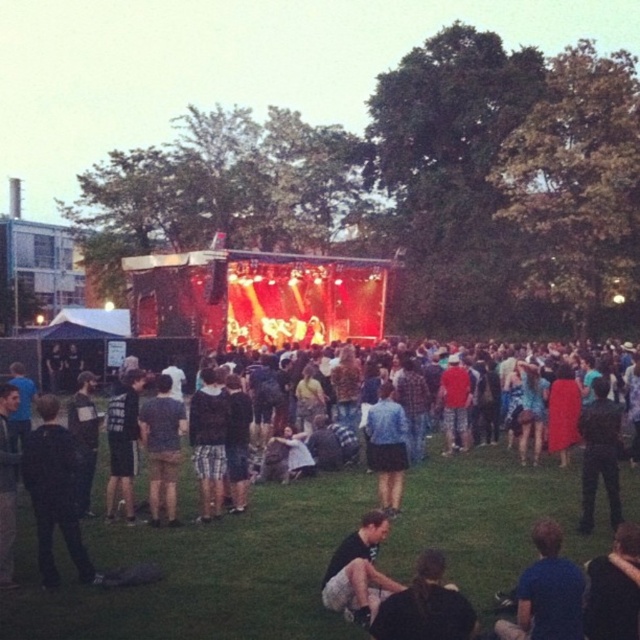
You are a photographer at the concert and want to capture a photo of the black matte jacket at left and dark gray fabric pants at lower center. Which object should you focus on first if you want to include both in the same frame without moving the camera?

The black matte jacket at left is above the dark gray fabric pants at lower center, so you should focus on the black matte jacket at left first to ensure both are in the frame.

You are standing at the center of the field and see a black matte jacket at left. Can you determine if the point marked at coordinates point (54,492) is located on the black matte jacket at left?

The point (54,492) is on the black matte jacket at left, so yes, the point is located on the black matte jacket at left.

You are a photographer at the concert and want to capture both the black fabric jacket at lower center and the dark blue shirt at lower right in the same frame. Since you want to ensure both are visible, which clothing item should you focus on first to make sure it fits in the frame?

The black fabric jacket at lower center is larger in size than the dark blue shirt at lower right, so you should focus on ensuring the larger black fabric jacket at lower center fits in the frame first to accommodate both.